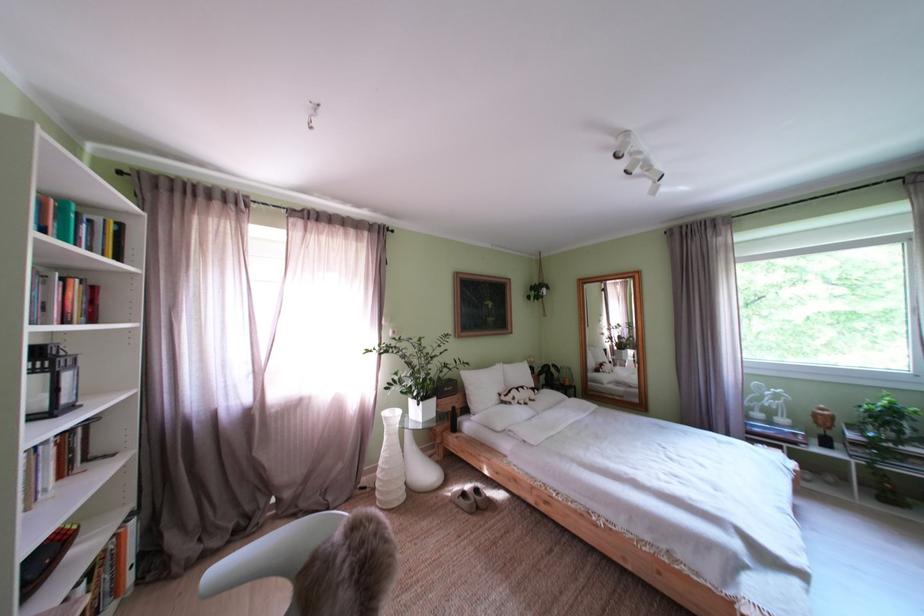
What do you see at coordinates (823, 426) in the screenshot? I see `the black lantern` at bounding box center [823, 426].